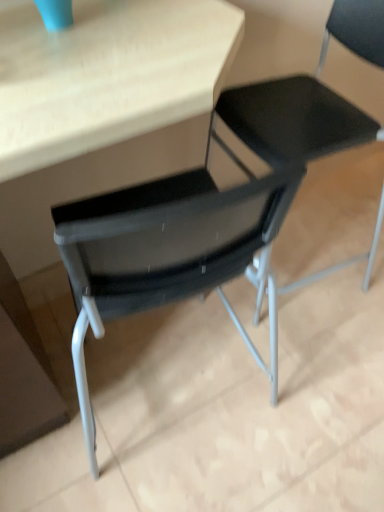
Where is `vacant area that is situated to the right of black mesh chair at center, the second chair in the right-to-left sequence`? vacant area that is situated to the right of black mesh chair at center, the second chair in the right-to-left sequence is located at coordinates (356, 246).